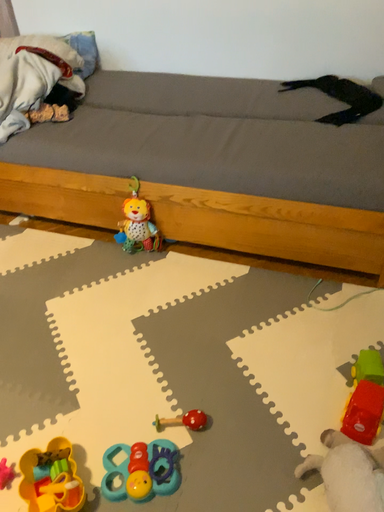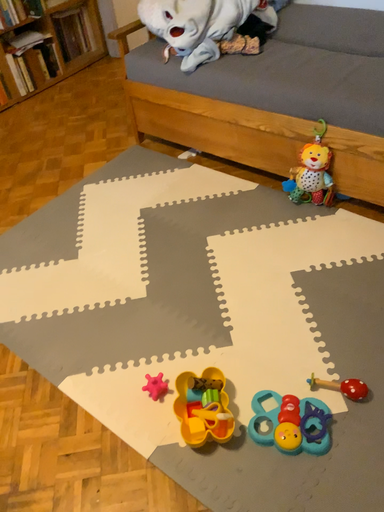
Question: How did the camera likely rotate when shooting the video?

Choices:
 (A) rotated right
 (B) rotated left

Answer: (B)